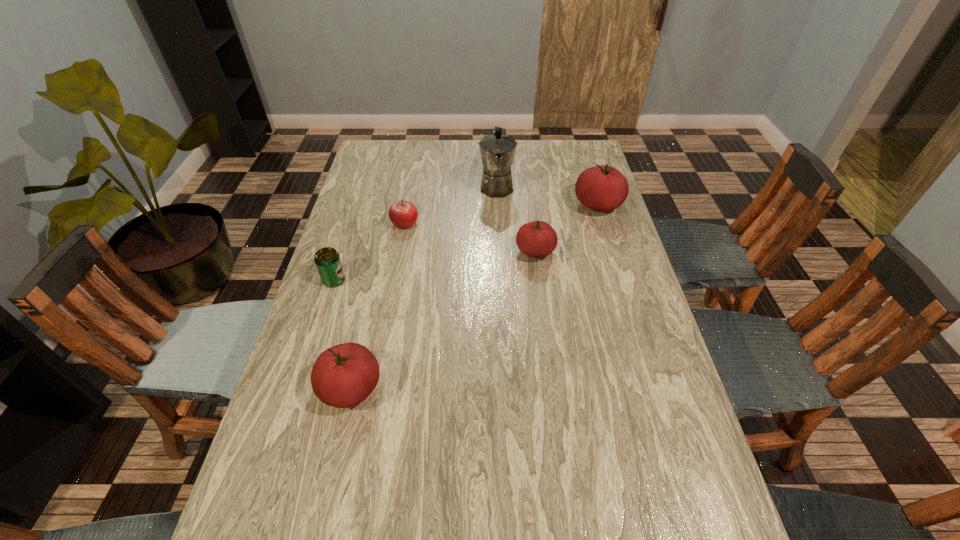
This screenshot has width=960, height=540. I want to click on object that is at the right edge, so click(602, 188).

Where is `free space at the near edge`? free space at the near edge is located at coordinates (574, 501).

Find the location of `vacant space at the left edge of the desktop`. vacant space at the left edge of the desktop is located at coordinates tap(336, 300).

The image size is (960, 540). In the image, there is a desktop. In order to click on vacant space at the near left corner in this screenshot , I will do `click(262, 500)`.

In order to click on vacant area at the far right corner in this screenshot , I will do `click(560, 139)`.

This screenshot has height=540, width=960. I want to click on vacant area that lies between the second tomato from left to right and the rightmost tomato, so point(566,228).

I want to click on vacant space that is in between the apple and the rightmost tomato, so click(501, 214).

Identify the location of vacant space that's between the nearest tomato and the tallest object. This screenshot has width=960, height=540. (424, 287).

Locate an element on the screen. Image resolution: width=960 pixels, height=540 pixels. blank region between the shortest tomato and the rightmost object is located at coordinates (566, 228).

Locate an element on the screen. unoccupied area between the leftmost object and the tallest object is located at coordinates (416, 233).